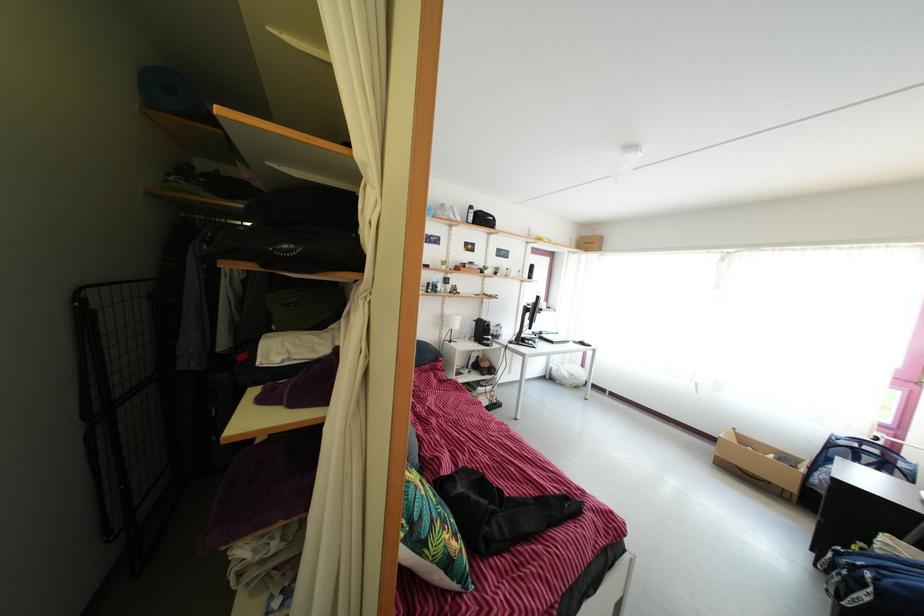
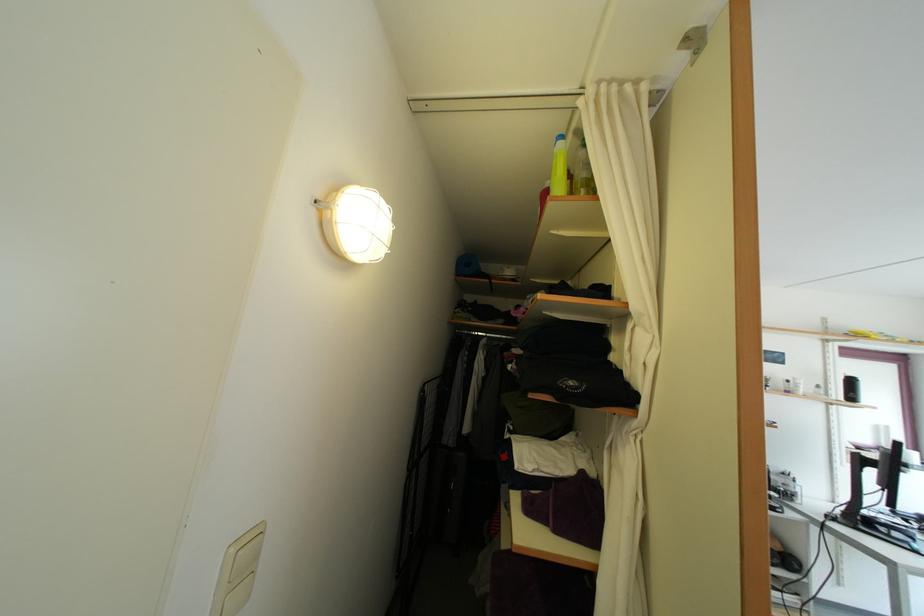
Where in the second image is the point corresponding to point 331,427 from the first image?

(602, 576)